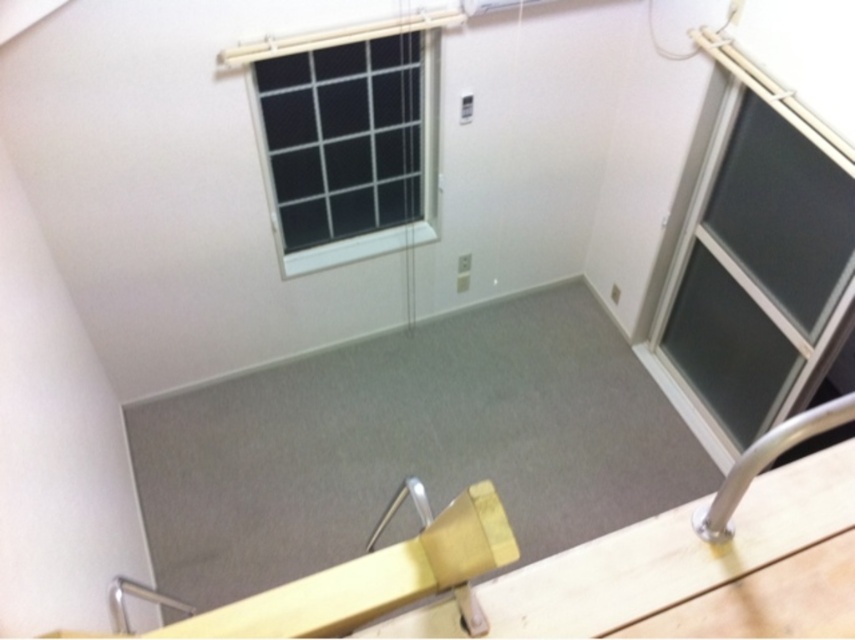
Question: Can you confirm if dark gray glass door at right is wider than black mesh window at upper center?

Choices:
 (A) yes
 (B) no

Answer: (B)

Question: Among these points, which one is nearest to the camera?

Choices:
 (A) click(x=298, y=156)
 (B) click(x=752, y=268)

Answer: (B)

Question: Is dark gray glass door at right below black mesh window at upper center?

Choices:
 (A) no
 (B) yes

Answer: (B)

Question: In this image, where is dark gray glass door at right located relative to black mesh window at upper center?

Choices:
 (A) above
 (B) below

Answer: (B)

Question: Which of the following is the closest to the observer?

Choices:
 (A) (363, 84)
 (B) (835, 304)

Answer: (B)